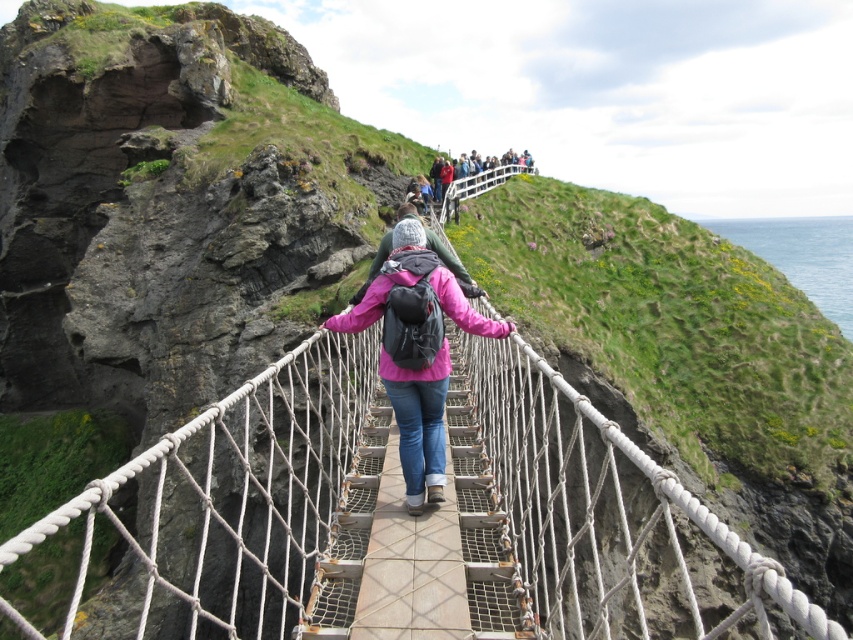
Question: Which object is closer to the camera taking this photo?

Choices:
 (A) pink matte jacket at center
 (B) matte black backpack at upper center
 (C) rope/woven wood bridge at center

Answer: (C)

Question: Which point is farther from the camera taking this photo?

Choices:
 (A) (438, 364)
 (B) (508, 168)
 (C) (392, 435)
 (D) (567, 545)

Answer: (B)

Question: Does pink matte jacket at center lie in front of matte black backpack at upper center?

Choices:
 (A) yes
 (B) no

Answer: (A)

Question: Which of the following is the farthest from the observer?

Choices:
 (A) green grassy at upper center
 (B) pink matte jacket at center

Answer: (A)

Question: Can you confirm if green grassy at upper center is positioned below wooden planks at center?

Choices:
 (A) no
 (B) yes

Answer: (A)

Question: Is rope/woven wood bridge at center above green grassy at upper center?

Choices:
 (A) no
 (B) yes

Answer: (A)